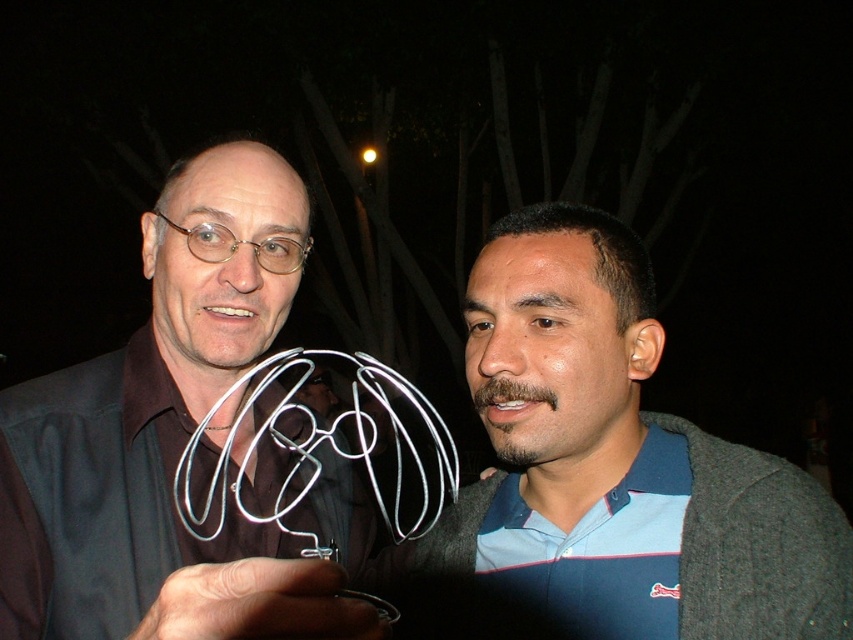
You are standing in front of the two people in the image. Which of the two points, point (448, 609) or point (115, 461), is closer to you?

Point (448, 609) is closer to you because it is further to the viewer than point (115, 461).

You are a photographer trying to capture the metallic wire sculpture at center without the blue fabric shirt at center blocking the view. Based on their positions, is it possible to take a clear photo of the sculpture without the shirt overlapping?

The blue fabric shirt at center is positioned over the metallic wire sculpture at center, so taking a clear photo without the shirt overlapping would be difficult as the shirt is covering part of the sculpture.